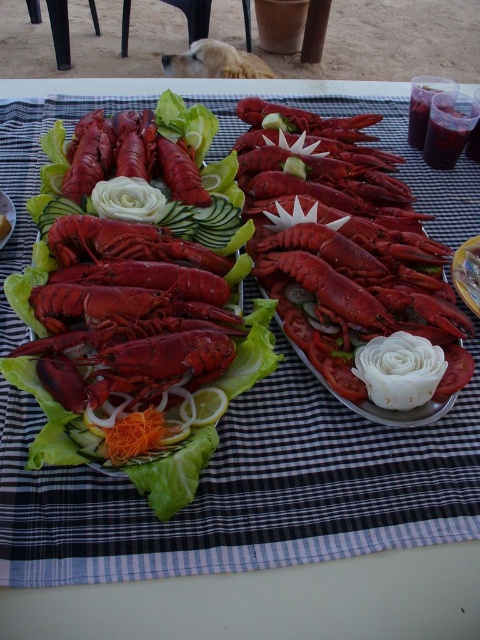
Question: Can you confirm if shiny red lobster at center is positioned above smooth orange cheese at center?

Choices:
 (A) no
 (B) yes

Answer: (B)

Question: Which is farther from the smooth orange cheese at center?

Choices:
 (A) green leafy lettuce at lower left
 (B) shiny red lobster at center
 (C) orange shredded carrot at center
 (D) matte white plate at center

Answer: (D)

Question: Is shiny red lobster at center above green leafy lettuce at lower left?

Choices:
 (A) no
 (B) yes

Answer: (A)

Question: Which point is farther to the camera?

Choices:
 (A) (8, 205)
 (B) (11, 227)
 (C) (455, 257)
 (D) (155, 445)

Answer: (A)

Question: Which object appears closest to the camera in this image?

Choices:
 (A) matte white plate at center
 (B) orange shredded carrot at center
 (C) green leafy lettuce at lower left
 (D) smooth orange cheese at center

Answer: (B)

Question: Observing the image, what is the correct spatial positioning of orange shredded carrot at center in reference to green leafy lettuce at lower left?

Choices:
 (A) left
 (B) right

Answer: (B)